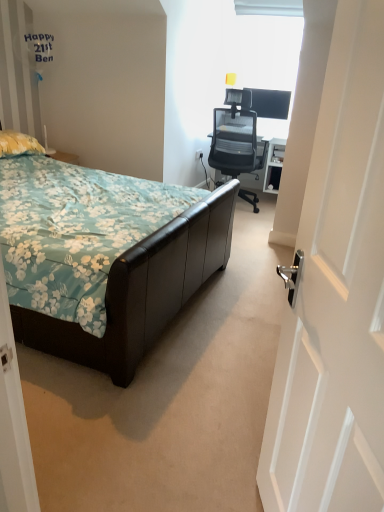
The width and height of the screenshot is (384, 512). What do you see at coordinates (104, 258) in the screenshot?
I see `leather bed at left` at bounding box center [104, 258].

Describe the element at coordinates (271, 103) in the screenshot. I see `matte black monitor at upper right` at that location.

What do you see at coordinates (336, 296) in the screenshot? Image resolution: width=384 pixels, height=512 pixels. I see `white glossy door at right` at bounding box center [336, 296].

Where is `white glossy door at right`? The height and width of the screenshot is (512, 384). white glossy door at right is located at coordinates (336, 296).

The width and height of the screenshot is (384, 512). I want to click on yellow fabric pillow at left, so click(x=18, y=144).

Which of these two, yellow fabric pillow at left or leather bed at left, is smaller?

yellow fabric pillow at left.

Is the depth of yellow fabric pillow at left greater than that of leather bed at left?

Yes, yellow fabric pillow at left is further from the viewer.

Is point (30, 137) positioned after point (150, 337)?

Yes, it is behind point (150, 337).

Is yellow fabric pillow at left taller than leather bed at left?

No.

From a real-world perspective, which object rests below the other?

black mesh office chair at upper right is physically lower.

What's the angular difference between matte black monitor at upper right and black mesh office chair at upper right's facing directions?

The angular difference between matte black monitor at upper right and black mesh office chair at upper right is 178 degrees.

Is matte black monitor at upper right facing towards black mesh office chair at upper right?

Yes.

Does matte black monitor at upper right lie in front of black mesh office chair at upper right?

That is False.

Is black mesh office chair at upper right positioned with its back to transparent glass window at upper center?

No, black mesh office chair at upper right's orientation is not away from transparent glass window at upper center.

From the picture: Does black mesh office chair at upper right have a greater height compared to transparent glass window at upper center?

Yes, black mesh office chair at upper right is taller than transparent glass window at upper center.

Based on the photo, which of these two, black mesh office chair at upper right or transparent glass window at upper center, is bigger?

black mesh office chair at upper right.

Does white plastic power outlet at center come in front of white glossy door at right?

No, white plastic power outlet at center is further to the viewer.

Would you say white plastic power outlet at center is to the left or to the right of white glossy door at right in the picture?

Clearly, white plastic power outlet at center is on the left of white glossy door at right in the image.

Looking at this image, is white plastic power outlet at center outside of white glossy door at right?

Yes.

Which of these two, white plastic power outlet at center or white glossy door at right, is thinner?

white plastic power outlet at center.

Does point (0, 137) lie behind point (253, 133)?

No, (0, 137) is closer to viewer.

Is yellow fabric pillow at left touching black mesh office chair at upper right?

No, yellow fabric pillow at left is not in contact with black mesh office chair at upper right.

Who is taller, yellow fabric pillow at left or black mesh office chair at upper right?

With more height is black mesh office chair at upper right.

From the image's perspective, is yellow fabric pillow at left located above black mesh office chair at upper right?

No, from the image's perspective, yellow fabric pillow at left is not over black mesh office chair at upper right.

Consider the image. How distant is black mesh office chair at upper right from matte black monitor at upper right?

They are 18.54 inches apart.

From the image's perspective, is black mesh office chair at upper right located above or below matte black monitor at upper right?

From the image's perspective, black mesh office chair at upper right appears below matte black monitor at upper right.

Identify the location of television lying on the right of black mesh office chair at upper right. The image size is (384, 512). (271, 103).

Is leather bed at left aimed at white plastic power outlet at center?

No, leather bed at left is not aimed at white plastic power outlet at center.

Considering the positions of points (170, 222) and (197, 159), is point (170, 222) farther from camera compared to point (197, 159)?

No, it is in front of (197, 159).

What are the coordinates of `bed on the right of the yellow fabric pillow at left` in the screenshot? It's located at (104, 258).

This screenshot has height=512, width=384. I want to click on chair on the left side of matte black monitor at upper right, so click(x=236, y=136).

Considering their positions, is black mesh office chair at upper right positioned further to transparent glass window at upper center than white plastic power outlet at center?

Based on the image, white plastic power outlet at center appears to be further to transparent glass window at upper center.

From the picture: Looking at the image, which one is located further to white glossy door at right, white plastic power outlet at center or matte black monitor at upper right?

Among the two, matte black monitor at upper right is located further to white glossy door at right.

From the image, which object appears to be farther from leather bed at left, black mesh office chair at upper right or white plastic power outlet at center?

white plastic power outlet at center lies further to leather bed at left than the other object.

Looking at the image, which one is located closer to white glossy door at right, transparent glass window at upper center or yellow fabric pillow at left?

yellow fabric pillow at left lies closer to white glossy door at right than the other object.

Considering their positions, is white glossy door at right positioned closer to leather bed at left than transparent glass window at upper center?

white glossy door at right is closer to leather bed at left.

Based on the photo, considering their positions, is black mesh office chair at upper right positioned closer to yellow fabric pillow at left than white plastic power outlet at center?

The object closer to yellow fabric pillow at left is black mesh office chair at upper right.

Looking at this image, from the image, which object appears to be farther from black mesh office chair at upper right, white glossy door at right or transparent glass window at upper center?

white glossy door at right is further to black mesh office chair at upper right.

Looking at the image, which one is located closer to matte black monitor at upper right, white plastic power outlet at center or black mesh office chair at upper right?

black mesh office chair at upper right is closer to matte black monitor at upper right.

Identify the location of chair between white glossy door at right and white plastic power outlet at center in the front-back direction. The image size is (384, 512). (236, 136).

I want to click on pillow positioned between leather bed at left and black mesh office chair at upper right from near to far, so click(x=18, y=144).

This screenshot has width=384, height=512. I want to click on chair between white glossy door at right and matte black monitor at upper right in the front-back direction, so click(x=236, y=136).

This screenshot has height=512, width=384. What are the coordinates of `bed between white glossy door at right and transparent glass window at upper center in the front-back direction` in the screenshot? It's located at 104,258.